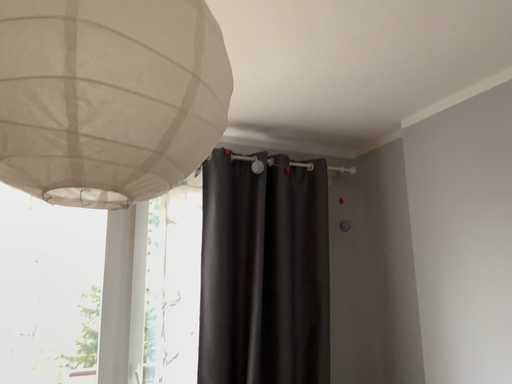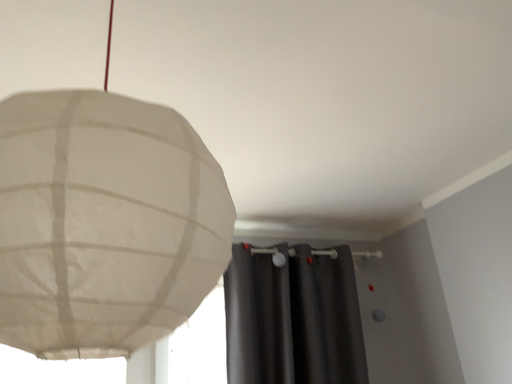
Question: Which way did the camera rotate in the video?

Choices:
 (A) rotated upward
 (B) rotated downward

Answer: (A)